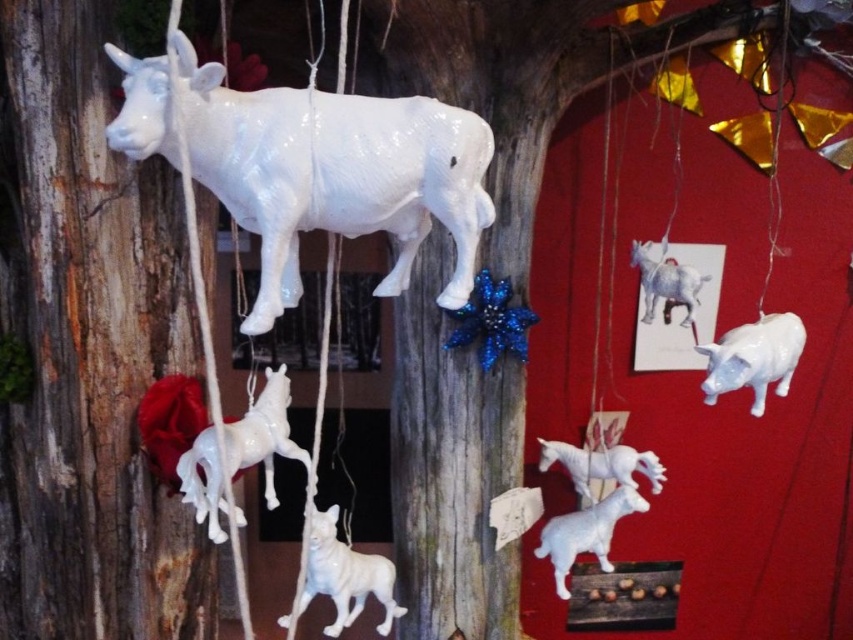
You are standing in front of the rustic scene. Where exactly is the smooth wood tree trunk at left located? Please provide its coordinates in the format of point followed by the coordinates in parentheses.

The smooth wood tree trunk at left is located at point [88,353].

You are an observer standing in front of the scene. You notice the smooth wood tree trunk at left and the white glossy cow at upper left. Which object is closer to you?

The smooth wood tree trunk at left is closer to you because the white glossy cow at upper left is behind it.

You are standing in front of the wooden tree trunk with the ceramic animals. There are two points marked on the scene at coordinates point (x=84, y=518) and point (x=358, y=566). Which point is closer to you?

Point (x=84, y=518) is closer to the viewer than point (x=358, y=566).